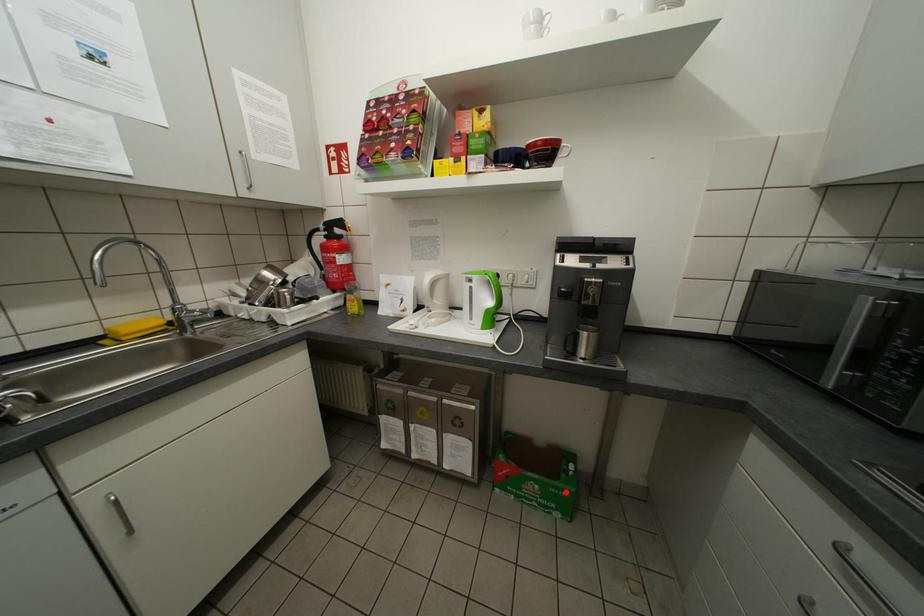
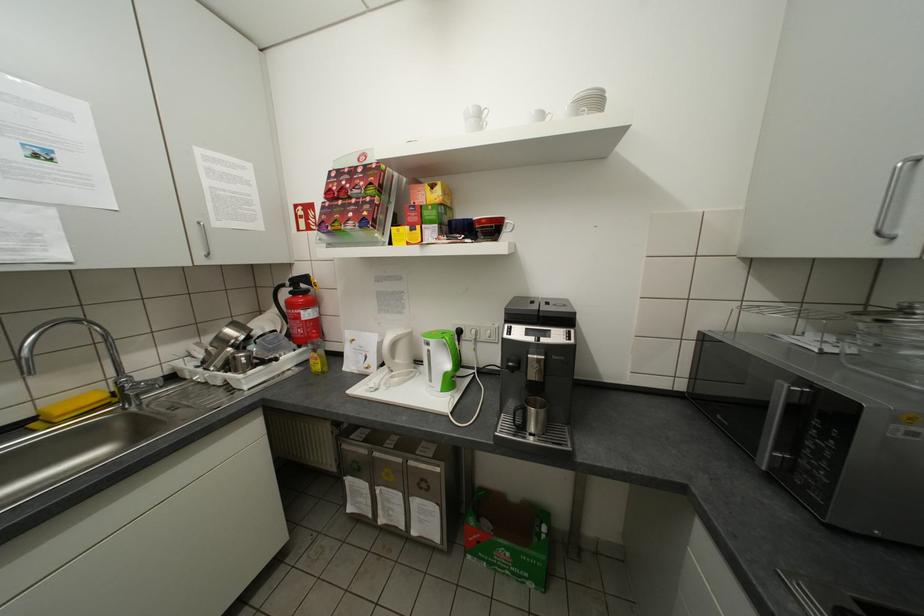
The point at the highlighted location is marked in the first image. Where is the corresponding point in the second image?

(537, 560)